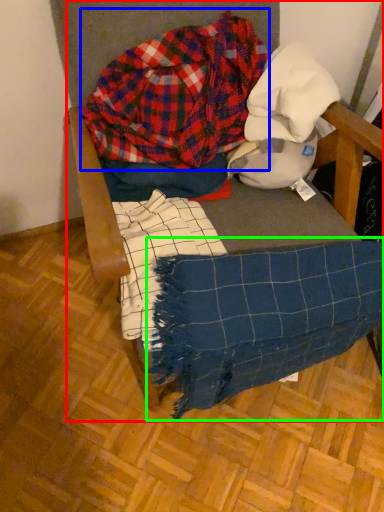
Question: Which object is positioned farthest from furniture (highlighted by a red box)? Select from flannel (highlighted by a blue box) and blanket (highlighted by a green box).

Choices:
 (A) flannel
 (B) blanket

Answer: (B)